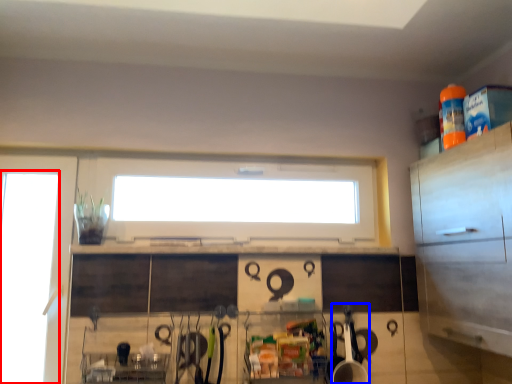
Question: Among these objects, which one is farthest to the camera, glass door (highlighted by a red box) or appliance (highlighted by a blue box)?

Choices:
 (A) glass door
 (B) appliance

Answer: (A)